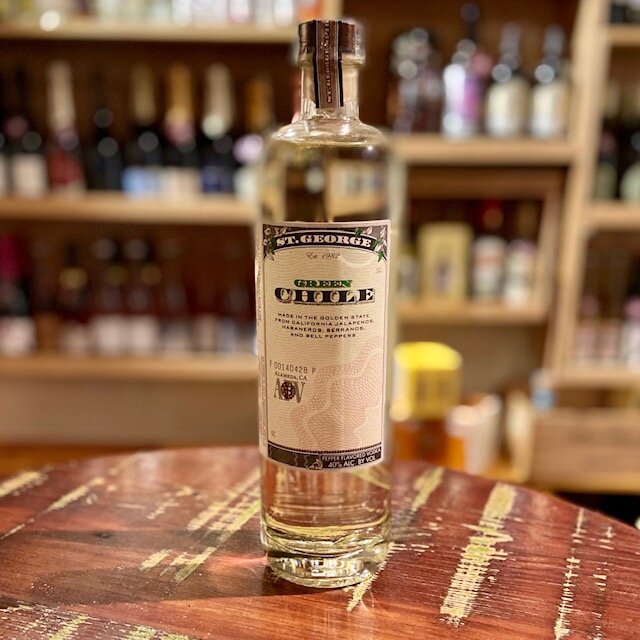
In order to click on liquor bottle in this screenshot , I will do `click(328, 161)`.